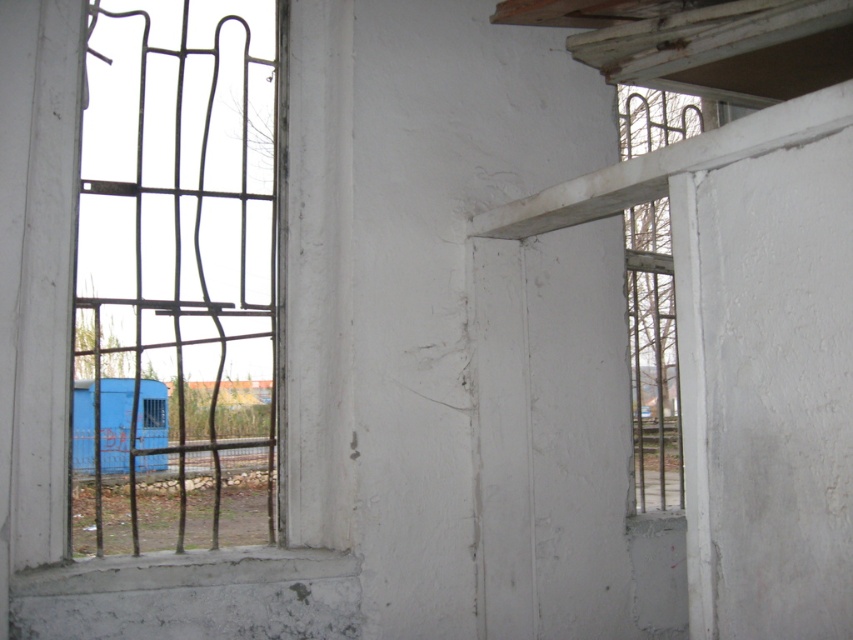
Question: Which object appears farthest from the camera in this image?

Choices:
 (A) white concrete window sill at lower left
 (B) metallic wire mesh at left

Answer: (B)

Question: Which of the following is the closest to the observer?

Choices:
 (A) metallic wire mesh at left
 (B) white concrete window sill at lower left

Answer: (B)

Question: Does metallic wire mesh at left appear on the left side of white concrete window sill at lower left?

Choices:
 (A) no
 (B) yes

Answer: (B)

Question: In this image, where is metallic wire mesh at left located relative to white concrete window sill at lower left?

Choices:
 (A) above
 (B) below

Answer: (A)

Question: Among these points, which one is nearest to the camera?

Choices:
 (A) (106, 570)
 (B) (312, 362)

Answer: (A)

Question: Does metallic wire mesh at left appear under white concrete window sill at lower left?

Choices:
 (A) yes
 (B) no

Answer: (B)